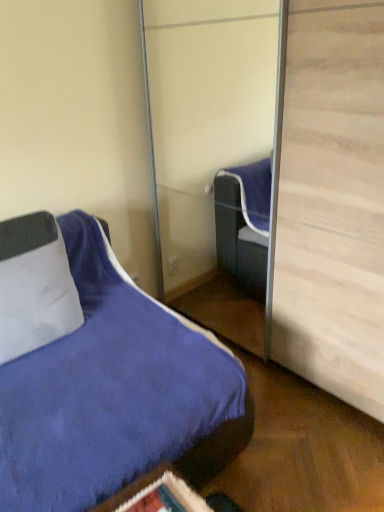
Question: From a real-world perspective, relative to white textured pillow at left, is suede blue bed at lower left vertically above or below?

Choices:
 (A) above
 (B) below

Answer: (B)

Question: Looking at the image, does suede blue bed at lower left seem bigger or smaller compared to white textured pillow at left?

Choices:
 (A) big
 (B) small

Answer: (A)

Question: Is point (97, 302) closer or farther from the camera than point (64, 260)?

Choices:
 (A) farther
 (B) closer

Answer: (A)

Question: From a real-world perspective, is white textured pillow at left physically located above or below suede blue bed at lower left?

Choices:
 (A) below
 (B) above

Answer: (B)

Question: Visually, is white textured pillow at left positioned to the left or to the right of suede blue bed at lower left?

Choices:
 (A) left
 (B) right

Answer: (A)

Question: Considering the positions of white textured pillow at left and suede blue bed at lower left in the image, is white textured pillow at left wider or thinner than suede blue bed at lower left?

Choices:
 (A) wide
 (B) thin

Answer: (B)

Question: Considering their positions, is white textured pillow at left located in front of or behind suede blue bed at lower left?

Choices:
 (A) behind
 (B) front

Answer: (A)